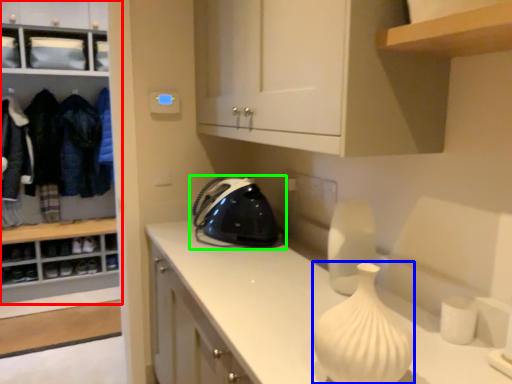
Question: Estimate the real-world distances between objects in this image. Which object is farther from cabinetry (highlighted by a red box), glass vase (highlighted by a blue box) or home appliance (highlighted by a green box)?

Choices:
 (A) glass vase
 (B) home appliance

Answer: (A)